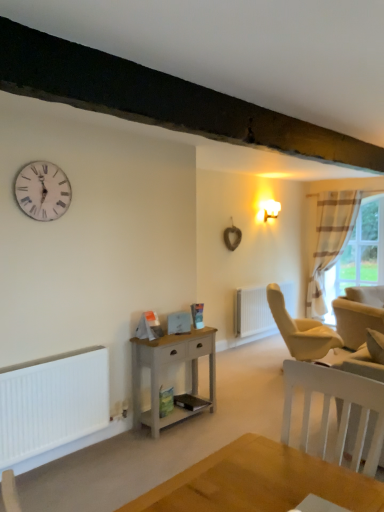
This screenshot has height=512, width=384. Find the location of `vacant region in front of light gray wood nightstand at center`. vacant region in front of light gray wood nightstand at center is located at coordinates (174, 445).